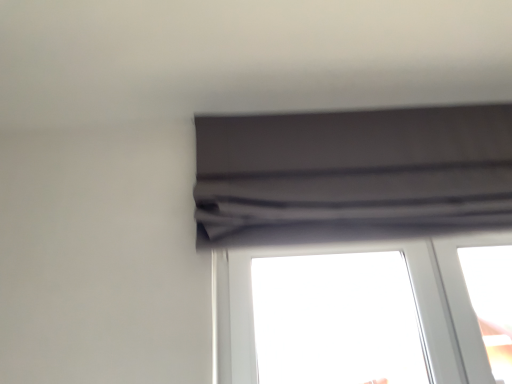
Where is `matte gray curtain at upper center`? The width and height of the screenshot is (512, 384). matte gray curtain at upper center is located at coordinates (352, 175).

What do you see at coordinates (352, 175) in the screenshot? I see `matte gray curtain at upper center` at bounding box center [352, 175].

What do you see at coordinates (412, 290) in the screenshot? I see `transparent glass window at center` at bounding box center [412, 290].

What is the approximate height of transparent glass window at center?

transparent glass window at center is 44.06 centimeters tall.

Identify the location of transparent glass window at center. (412, 290).

The width and height of the screenshot is (512, 384). What are the coordinates of `matte gray curtain at upper center` in the screenshot? It's located at (352, 175).

Does transparent glass window at center appear on the right side of matte gray curtain at upper center?

In fact, transparent glass window at center is to the left of matte gray curtain at upper center.

Is the position of transparent glass window at center more distant than that of matte gray curtain at upper center?

That is True.

Is point (459, 266) less distant than point (327, 223)?

That is False.

From the image's perspective, would you say transparent glass window at center is positioned over matte gray curtain at upper center?

No, from the image's perspective, transparent glass window at center is not over matte gray curtain at upper center.

From a real-world perspective, is transparent glass window at center positioned under matte gray curtain at upper center based on gravity?

Yes.

Is transparent glass window at center thinner than matte gray curtain at upper center?

Yes, transparent glass window at center is thinner than matte gray curtain at upper center.

Considering the sizes of objects transparent glass window at center and matte gray curtain at upper center in the image provided, who is taller, transparent glass window at center or matte gray curtain at upper center?

Standing taller between the two is matte gray curtain at upper center.

Based on their sizes in the image, would you say transparent glass window at center is bigger or smaller than matte gray curtain at upper center?

Considering their sizes, transparent glass window at center takes up less space than matte gray curtain at upper center.

Could matte gray curtain at upper center be considered to be inside transparent glass window at center?

No.

From the picture: Is transparent glass window at center touching matte gray curtain at upper center?

They are not placed beside each other.

Is matte gray curtain at upper center at the back of transparent glass window at center?

No.

How much distance is there between transparent glass window at center and matte gray curtain at upper center?

transparent glass window at center is 10.21 inches from matte gray curtain at upper center.

Image resolution: width=512 pixels, height=384 pixels. What are the coordinates of `window that appears on the left of matte gray curtain at upper center` in the screenshot? It's located at (412, 290).

Does matte gray curtain at upper center appear on the right side of transparent glass window at center?

Yes, matte gray curtain at upper center is to the right of transparent glass window at center.

Is matte gray curtain at upper center positioned before transparent glass window at center?

Yes.

Considering the positions of point (226, 120) and point (450, 369), is point (226, 120) closer or farther from the camera than point (450, 369)?

Point (226, 120).

From the image's perspective, is matte gray curtain at upper center positioned above or below transparent glass window at center?

Based on their image positions, matte gray curtain at upper center is located above transparent glass window at center.

From a real-world perspective, between matte gray curtain at upper center and transparent glass window at center, who is vertically higher?

From a 3D spatial view, matte gray curtain at upper center is above.

Which of these two, matte gray curtain at upper center or transparent glass window at center, is wider?

matte gray curtain at upper center is wider.

Does matte gray curtain at upper center have a lesser height compared to transparent glass window at center?

No, matte gray curtain at upper center is not shorter than transparent glass window at center.

Which of these two, matte gray curtain at upper center or transparent glass window at center, is smaller?

With smaller size is transparent glass window at center.

Is transparent glass window at center a part of matte gray curtain at upper center?

That's incorrect, transparent glass window at center is not inside matte gray curtain at upper center.

Is matte gray curtain at upper center beside transparent glass window at center?

There is a gap between matte gray curtain at upper center and transparent glass window at center.

Is matte gray curtain at upper center looking in the opposite direction of transparent glass window at center?

No, matte gray curtain at upper center is not facing away from transparent glass window at center.

How different are the orientations of matte gray curtain at upper center and transparent glass window at center in degrees?

They differ by 0.00214 degrees in their facing directions.

Based on the photo, measure the distance between matte gray curtain at upper center and transparent glass window at center.

matte gray curtain at upper center and transparent glass window at center are 10.21 inches apart from each other.

Identify the location of curtain on the right of transparent glass window at center. (352, 175).

Identify the location of curtain lying on the right of transparent glass window at center. This screenshot has height=384, width=512. (352, 175).

The height and width of the screenshot is (384, 512). In order to click on window behind the matte gray curtain at upper center in this screenshot , I will do coord(412,290).